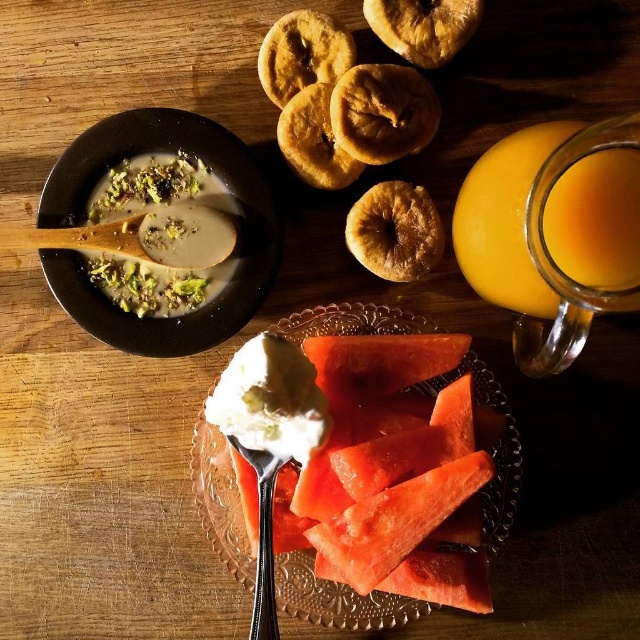
You are setting up a breakfast table and need to place both the translucent glass jar of orange juice at upper right and the white creamy soup at upper left. Given their sizes, which one requires more space on the table?

The translucent glass jar of orange juice at upper right requires more space on the table because it is larger in size than the white creamy soup at upper left.

You are planning to serve a drink and a dessert to your guests. The pink juicy watermelon slices at center and the translucent glass jar of orange juice at upper right are available. Which item should you choose for the dessert, and why?

The pink juicy watermelon slices at center should be chosen for dessert because it is larger in size compared to the translucent glass jar of orange juice at upper right, making it more suitable as a dessert portion.

You are setting up a picnic and have a basket that can only fit items narrower than 10 inches. You need to place both the pink juicy watermelon slices at center and the translucent glass jar of orange juice at upper right into the basket. Based on their widths, can both items fit in the basket?

The pink juicy watermelon slices at center might be wider than the translucent glass jar of orange juice at upper right. Since the basket requires items narrower than 10 inches, we need to know the exact width of the watermelon slices. If they are under 10 inches, both can fit. However, without specific measurements, we can only assume based on the description that the watermelon slices might exceed the jar in width but not necessarily the basket limit. Further details are needed for a definitive answer.